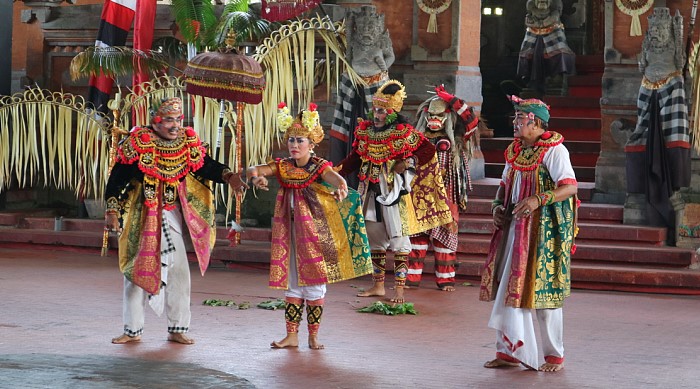
In order to click on plant in this screenshot , I will do `click(234, 29)`, `click(113, 59)`.